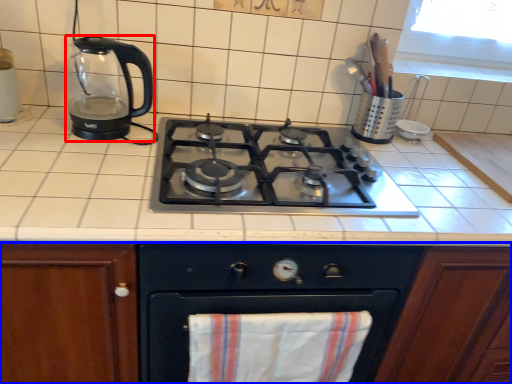
Question: Among these objects, which one is nearest to the camera, kitchen appliance (highlighted by a red box) or cabinetry (highlighted by a blue box)?

Choices:
 (A) kitchen appliance
 (B) cabinetry

Answer: (B)